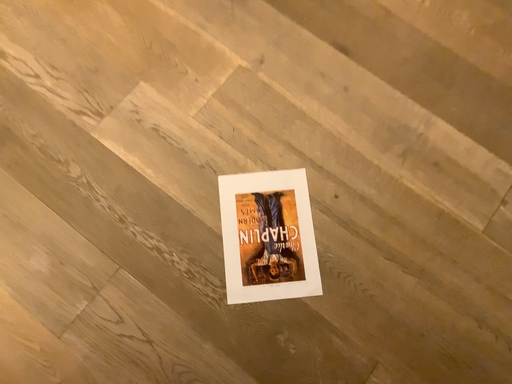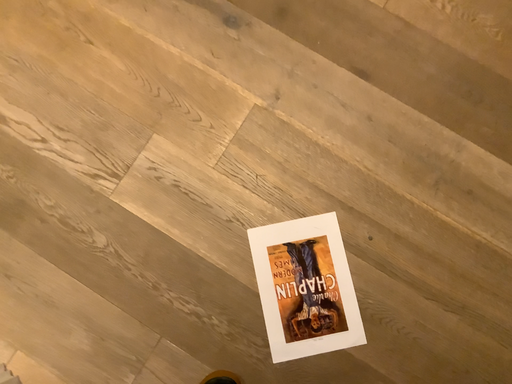
Question: How did the camera likely rotate when shooting the video?

Choices:
 (A) rotated upward
 (B) rotated downward

Answer: (B)